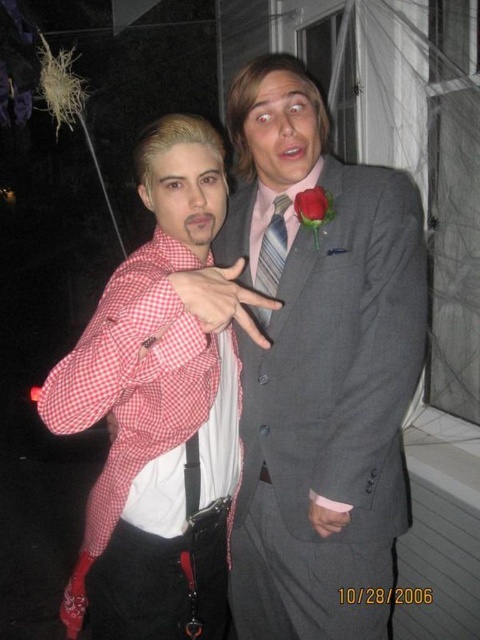
You are a photographer adjusting the camera focus. The camera is set to focus at point coordinates 0.5, 0.6. Which object between the matte gray suit at center and the other person in the image is closer to the focus point?

The matte gray suit at center is located at point coordinates (321, 371), which is closer to the focus point at (288, 320) than the other person. Therefore, the matte gray suit at center will be in focus.

In the nighttime scene, there are two people. The person on the left is wearing a checkered fabric shirt at left, and the person on the right has a pink striped tie at center. From the perspective of someone standing in front of them, which clothing item is positioned to the left?

The checkered fabric shirt at left is to the left of the pink striped tie at center, so the checkered fabric shirt at left is positioned to the left.

You are a photographer adjusting the camera focus for a portrait of the two people. The pink striped tie at center and the red velvet rose at upper center are both in the frame. Which object should you focus on first if you want to ensure the larger one is sharp?

The pink striped tie at center should be focused on first because it has a larger size compared to the red velvet rose at upper center.